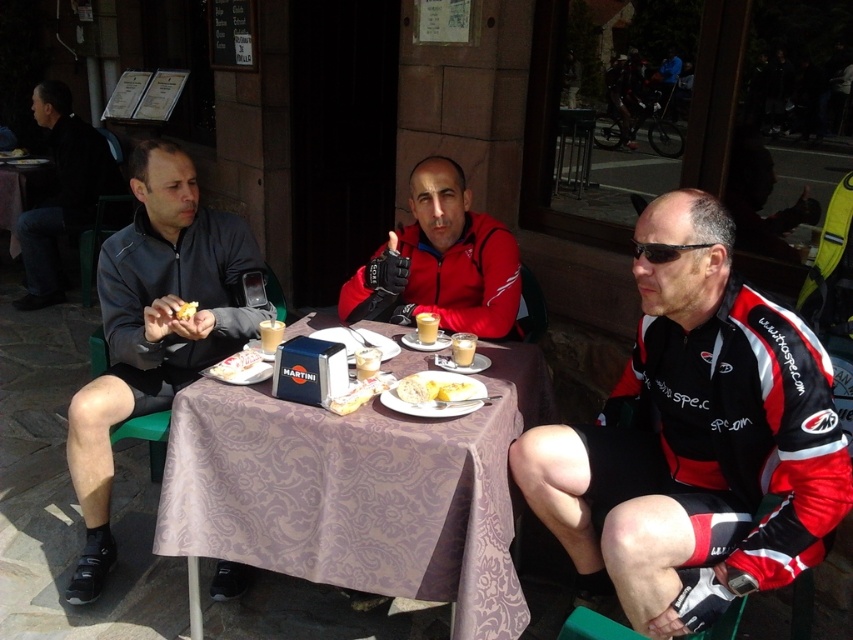
Does red and black cycling jersey at center lie behind matte cardboard box at center?

No, red and black cycling jersey at center is closer to the viewer.

Can you confirm if red and black cycling jersey at center is positioned above matte cardboard box at center?

Actually, red and black cycling jersey at center is below matte cardboard box at center.

Is point (669, 600) closer to camera compared to point (305, 336)?

Yes, point (669, 600) is closer to viewer.

Locate an element on the screen. red and black cycling jersey at center is located at coordinates (695, 440).

Which of these two, red and black cycling jersey at center or white creamy cake at center, stands taller?

red and black cycling jersey at center

I want to click on red and black cycling jersey at center, so click(x=695, y=440).

Between point (234, 356) and point (193, 304), which one is positioned in front?

Point (234, 356)

Can you confirm if white creamy cake at center is bigger than yellow crumbly bread at center?

Indeed, white creamy cake at center has a larger size compared to yellow crumbly bread at center.

Is point (233, 372) closer to viewer compared to point (195, 308)?

Yes, point (233, 372) is in front of point (195, 308).

Where is `white creamy cake at center`? This screenshot has width=853, height=640. white creamy cake at center is located at coordinates (235, 365).